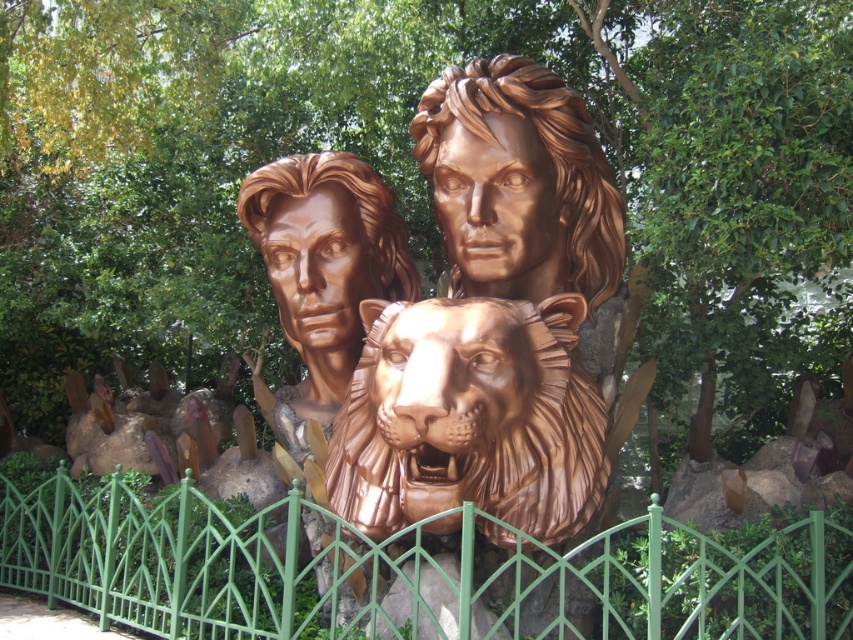
Looking at this image, you are a visitor at an art exhibition and want to take a photo of the bronze statue at center without the bronze lion head at upper center appearing in the frame. How can you adjust your position to achieve this?

Since the bronze lion head at upper center is behind the bronze statue at center, you can position yourself so that the bronze statue at center blocks the view of the bronze lion head at upper center, ensuring it doesn

You are an art student analyzing the sculpture. You notice the bronze statue at center and the bronze lion head at upper center. Which one do you think is bigger in size?

The bronze statue at center is larger in size compared to the bronze lion head at upper center.